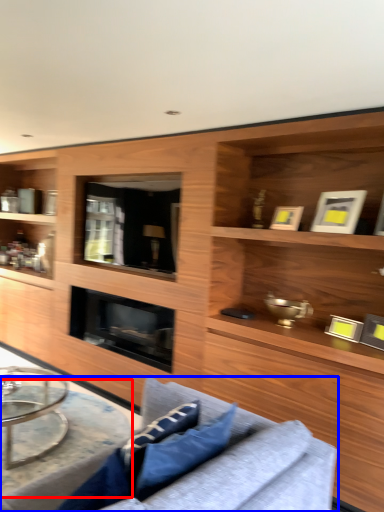
Question: Which of the following is the closest to the observer, round table (highlighted by a red box) or studio couch (highlighted by a blue box)?

Choices:
 (A) round table
 (B) studio couch

Answer: (B)